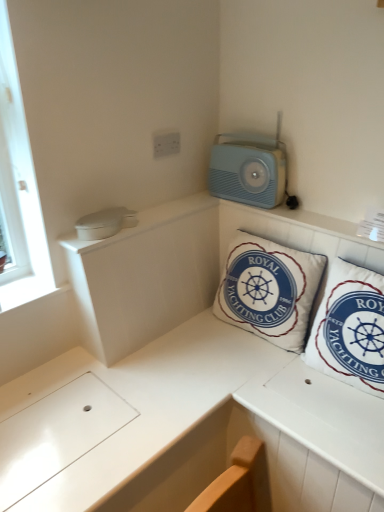
Question: Is white fabric pillow at upper right, positioned as the second pillow in left-to-right order, positioned in front of light blue plastic radio at upper right?

Choices:
 (A) no
 (B) yes

Answer: (B)

Question: Does white fabric pillow at upper right, positioned as the second pillow in left-to-right order, have a lesser height compared to light blue plastic radio at upper right?

Choices:
 (A) no
 (B) yes

Answer: (A)

Question: From a real-world perspective, is white fabric pillow at upper right, positioned as the second pillow in left-to-right order, on light blue plastic radio at upper right?

Choices:
 (A) yes
 (B) no

Answer: (B)

Question: From a real-world perspective, is white fabric pillow at upper right, positioned as the second pillow in left-to-right order, below light blue plastic radio at upper right?

Choices:
 (A) yes
 (B) no

Answer: (A)

Question: Can light blue plastic radio at upper right be found inside white fabric pillow at upper right, positioned as the second pillow in left-to-right order?

Choices:
 (A) no
 (B) yes

Answer: (A)

Question: Would you say white plastic electric outlet at upper center is inside or outside white fabric pillow at upper right, positioned as the second pillow in left-to-right order?

Choices:
 (A) outside
 (B) inside

Answer: (A)

Question: From a real-world perspective, is white plastic electric outlet at upper center above or below white fabric pillow at upper right, positioned as the second pillow in left-to-right order?

Choices:
 (A) above
 (B) below

Answer: (A)

Question: From their relative heights in the image, would you say white plastic electric outlet at upper center is taller or shorter than white fabric pillow at upper right, positioned as the second pillow in left-to-right order?

Choices:
 (A) short
 (B) tall

Answer: (A)

Question: Is white plastic electric outlet at upper center in front of or behind white fabric pillow at upper right, positioned as the second pillow in left-to-right order, in the image?

Choices:
 (A) front
 (B) behind

Answer: (B)

Question: From a real-world perspective, relative to white plastic electric outlet at upper center, is light blue plastic radio at upper right vertically above or below?

Choices:
 (A) above
 (B) below

Answer: (B)

Question: Is light blue plastic radio at upper right inside or outside of white plastic electric outlet at upper center?

Choices:
 (A) outside
 (B) inside

Answer: (A)

Question: Is point (271, 181) closer or farther from the camera than point (163, 143)?

Choices:
 (A) farther
 (B) closer

Answer: (B)

Question: In terms of height, does light blue plastic radio at upper right look taller or shorter compared to white plastic electric outlet at upper center?

Choices:
 (A) short
 (B) tall

Answer: (B)

Question: Is white fabric pillow at upper right, positioned as the second pillow in left-to-right order, bigger or smaller than light blue plastic radio at upper right?

Choices:
 (A) big
 (B) small

Answer: (A)

Question: Considering the positions of white fabric pillow at upper right, positioned as the second pillow in left-to-right order, and light blue plastic radio at upper right in the image, is white fabric pillow at upper right, positioned as the second pillow in left-to-right order, taller or shorter than light blue plastic radio at upper right?

Choices:
 (A) short
 (B) tall

Answer: (B)